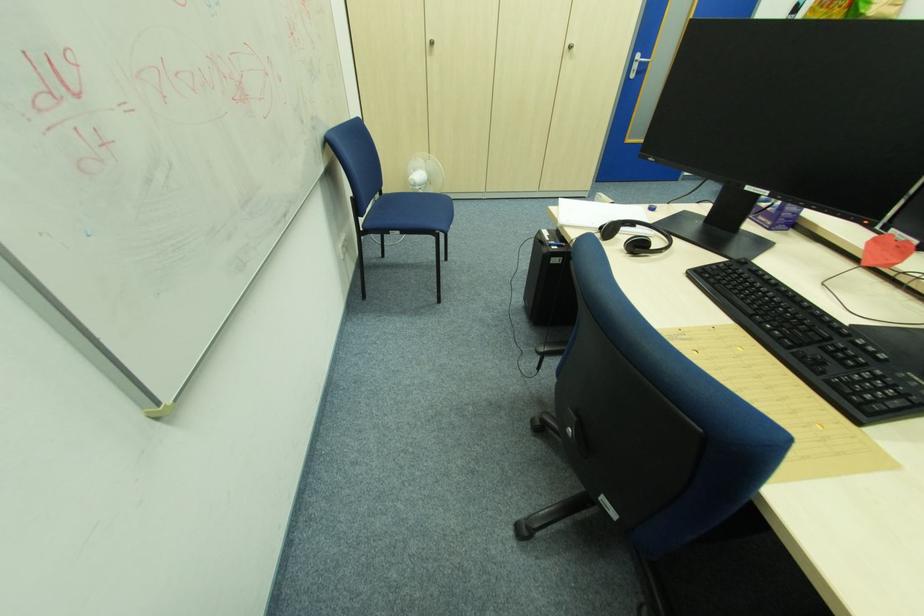
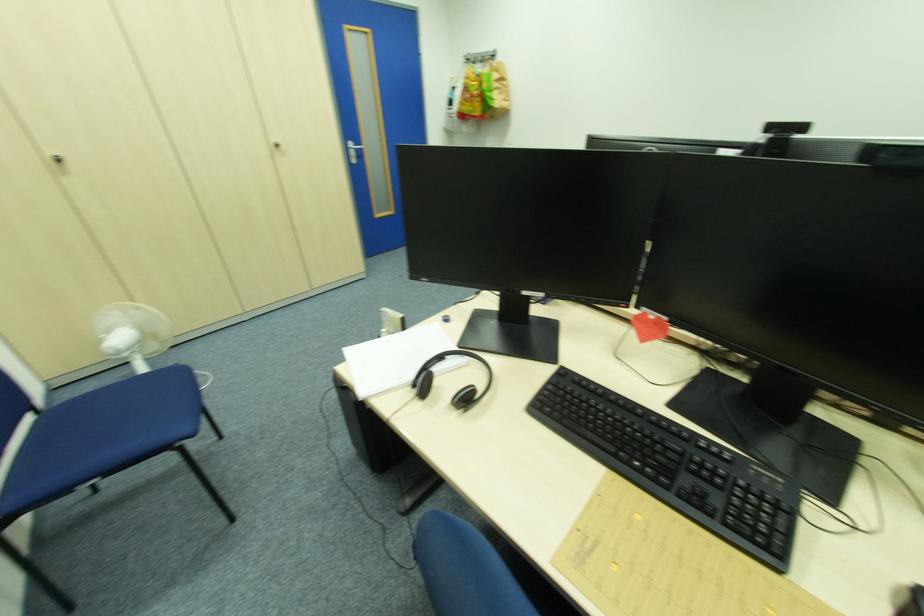
Locate, in the second image, the point that corresponds to the point at 605,229 in the first image.

(419, 387)